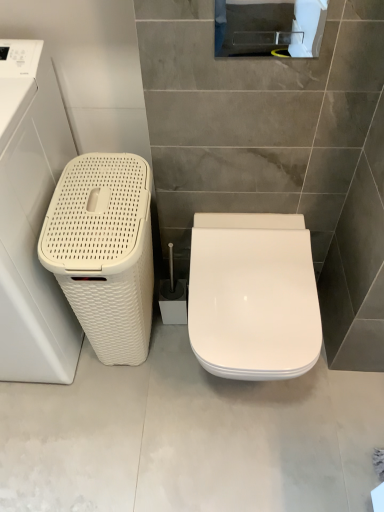
Where is `white glossy toilet seat at center`? This screenshot has width=384, height=512. white glossy toilet seat at center is located at coordinates (253, 296).

In order to face white glossy toilet at center, should I rotate leftwards or rightwards?

Turn right approximately 0.094 degrees to face it.

Locate an element on the screen. The image size is (384, 512). white woven basket at left is located at coordinates [104, 251].

Looking at this image, is the position of white woven basket at left less distant than that of white glossy toilet seat at center?

Yes, white woven basket at left is closer to the viewer.

Consider the image. From a real-world perspective, which is physically above, white woven basket at left or white glossy toilet seat at center?

From a 3D spatial view, white woven basket at left is above.

Is white woven basket at left not near white glossy toilet seat at center?

white woven basket at left is actually quite close to white glossy toilet seat at center.

Is white glossy toilet at center not close to white glossy toilet seat at center?

Actually, white glossy toilet at center and white glossy toilet seat at center are a little close together.

How many degrees apart are the facing directions of white glossy toilet at center and white glossy toilet seat at center?

90.2 degrees.

Which object is more forward, white glossy toilet at center or white glossy toilet seat at center?

white glossy toilet seat at center is in front.

Do you think white glossy toilet at center is within white glossy toilet seat at center, or outside of it?

white glossy toilet at center is not inside white glossy toilet seat at center, it's outside.

Considering the sizes of white woven basket at left and white glossy toilet at center in the image, is white woven basket at left bigger or smaller than white glossy toilet at center?

Considering their sizes, white woven basket at left takes up more space than white glossy toilet at center.

Which object is further away from the camera taking this photo, white woven basket at left or white glossy toilet at center?

white glossy toilet at center is more distant.

From a real-world perspective, is white woven basket at left beneath white glossy toilet at center?

No.

Is white woven basket at left looking in the opposite direction of white glossy toilet at center?

white woven basket at left does not have its back to white glossy toilet at center.

Considering the relative positions of white glossy toilet seat at center and white woven basket at left in the image provided, is white glossy toilet seat at center to the right of white woven basket at left from the viewer's perspective?

Correct, you'll find white glossy toilet seat at center to the right of white woven basket at left.

Considering the sizes of objects white glossy toilet seat at center and white woven basket at left in the image provided, who is thinner, white glossy toilet seat at center or white woven basket at left?

white woven basket at left is thinner.

Consider the image. Are white glossy toilet seat at center and white woven basket at left making contact?

white glossy toilet seat at center and white woven basket at left are clearly separated.

Looking at this image, what's the angular difference between white glossy toilet at center and white woven basket at left's facing directions?

They differ by 90.6 degrees in their facing directions.

Is white glossy toilet at center directly adjacent to white woven basket at left?

No.

Can you confirm if white glossy toilet at center is positioned to the right of white woven basket at left?

Correct, you'll find white glossy toilet at center to the right of white woven basket at left.

Can you confirm if white glossy toilet at center is thinner than white woven basket at left?

No, white glossy toilet at center is not thinner than white woven basket at left.

In the image, is white glossy toilet at center on the left side or the right side of white woven basket at left?

white glossy toilet at center is positioned on white woven basket at left's right side.

From the image's perspective, is white glossy toilet at center on white woven basket at left?

No, from the image's perspective, white glossy toilet at center is not over white woven basket at left.

Looking at this image, are white glossy toilet at center and white woven basket at left located far from each other?

Actually, white glossy toilet at center and white woven basket at left are a little close together.

Considering the sizes of objects white woven basket at left and white glossy toilet seat at center in the image provided, who is wider, white woven basket at left or white glossy toilet seat at center?

With larger width is white glossy toilet seat at center.

Which object is positioned more to the right, white woven basket at left or white glossy toilet seat at center?

white glossy toilet seat at center.

Is white woven basket at left placed right next to white glossy toilet seat at center?

No, white woven basket at left is not beside white glossy toilet seat at center.

Is white woven basket at left bigger or smaller than white glossy toilet seat at center?

In the image, white woven basket at left appears to be larger than white glossy toilet seat at center.

There is a white glossy toilet seat at center. Find the location of `washing machine above it (from a real-world perspective)`. washing machine above it (from a real-world perspective) is located at coordinates (31, 219).

You are a GUI agent. You are given a task and a screenshot of the screen. Output one action in this format:
    pyautogui.click(x=<x>, y=<y>)
    Task: Click on the toilet that appears on the right of white glossy toilet at center
    This screenshot has height=512, width=384.
    Given the screenshot: What is the action you would take?
    pyautogui.click(x=253, y=296)

Looking at the image, which one is located further to white woven basket at left, white woven basket at left or white glossy toilet at center?

Among the two, white glossy toilet at center is located further to white woven basket at left.

Which object lies further to the anchor point white woven basket at left, white glossy toilet at center or white woven basket at left?

white glossy toilet at center is positioned further to the anchor white woven basket at left.

Which object lies further to the anchor point white glossy toilet at center, white woven basket at left or white glossy toilet seat at center?

The object further to white glossy toilet at center is white woven basket at left.

When comparing their distances from white woven basket at left, does white glossy toilet at center or white woven basket at left seem closer?

The object closer to white woven basket at left is white woven basket at left.

From the image, which object appears to be farther from white glossy toilet at center, white woven basket at left or white woven basket at left?

white woven basket at left is positioned further to the anchor white glossy toilet at center.

Which object lies nearer to the anchor point white glossy toilet seat at center, white glossy toilet at center or white woven basket at left?

white glossy toilet at center lies closer to white glossy toilet seat at center than the other object.

From the image, which object appears to be nearer to white woven basket at left, white woven basket at left or white glossy toilet at center?

white woven basket at left is positioned closer to the anchor white woven basket at left.

Which object lies further to the anchor point white glossy toilet seat at center, white woven basket at left or white glossy toilet at center?

Among the two, white glossy toilet at center is located further to white glossy toilet seat at center.

I want to click on concrete between white woven basket at left and white glossy toilet seat at center in the horizontal direction, so click(x=189, y=437).

You are a GUI agent. You are given a task and a screenshot of the screen. Output one action in this format:
    pyautogui.click(x=<x>, y=<y>)
    Task: Click on the dish washer situated between white woven basket at left and white glossy toilet seat at center from left to right
    This screenshot has height=512, width=384.
    Given the screenshot: What is the action you would take?
    pyautogui.click(x=104, y=251)

Locate an element on the screen. dish washer between white woven basket at left and white glossy toilet at center is located at coordinates (104, 251).

I want to click on concrete between white woven basket at left and white glossy toilet seat at center, so [189, 437].